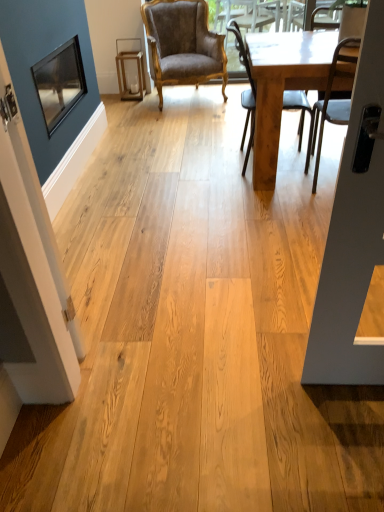
Image resolution: width=384 pixels, height=512 pixels. Identify the location of vacant space positioned to the left of light brown wooden table at right. (187, 168).